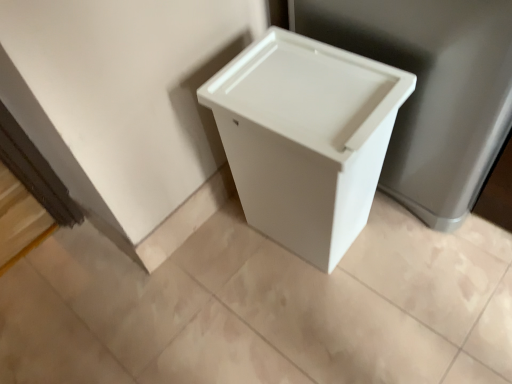
Image resolution: width=512 pixels, height=384 pixels. What are the coordinates of `blank space to the left of white plastic waste container at center` in the screenshot? It's located at (220, 269).